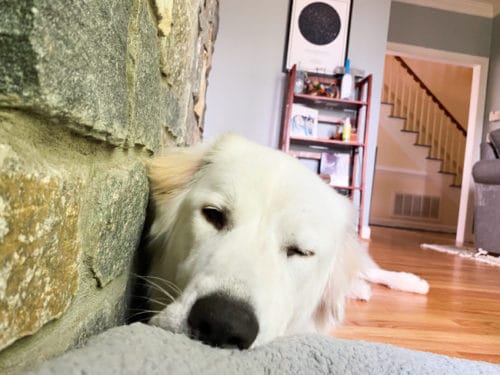
This screenshot has width=500, height=375. In order to click on space between door and ceiling in this screenshot , I will do `click(447, 24)`.